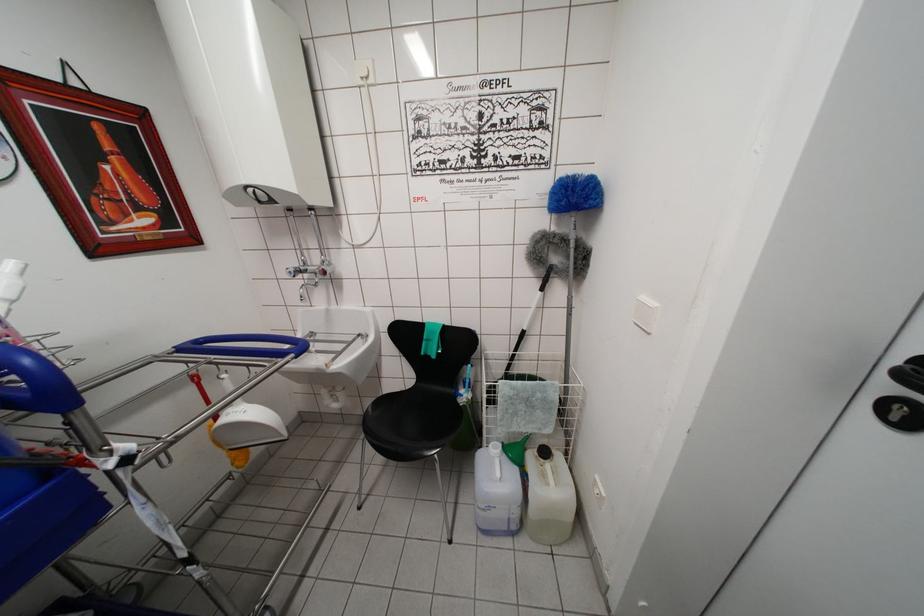
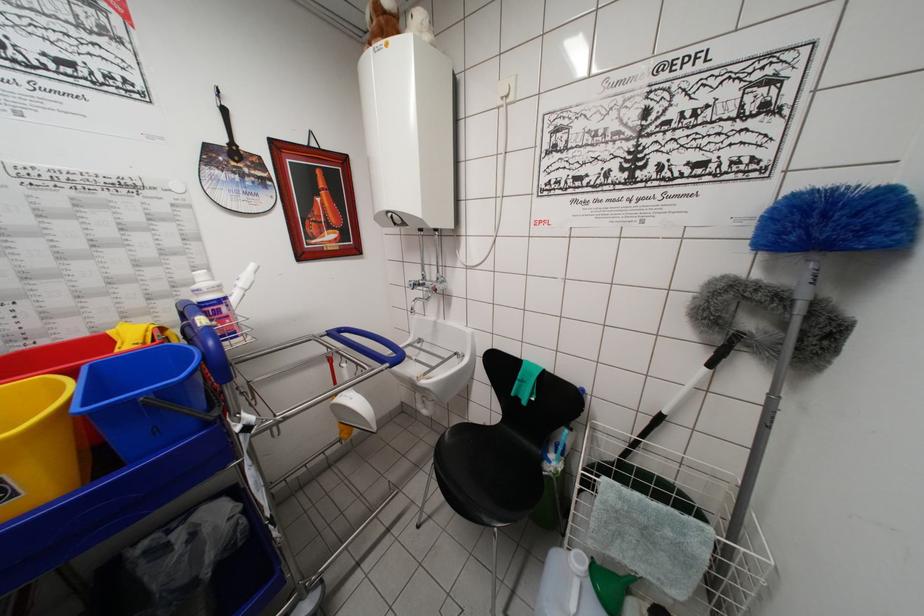
The point at (310, 282) is marked in the first image. Where is the corresponding point in the second image?

(428, 294)